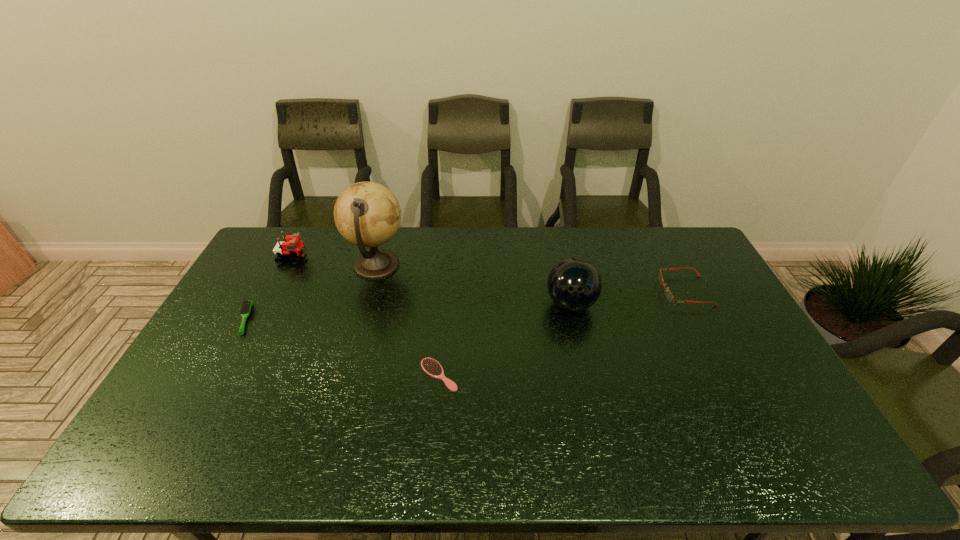
Where is `Lego that is positioned at the far edge`? The height and width of the screenshot is (540, 960). Lego that is positioned at the far edge is located at coordinates (292, 247).

Locate an element on the screen. Lego that is at the left edge is located at coordinates (292, 247).

Find the location of `hairbrush that is positioned at the left edge`. hairbrush that is positioned at the left edge is located at coordinates (245, 309).

What are the coordinates of `object located in the right edge section of the desktop` in the screenshot? It's located at (669, 296).

Find the location of a particular element. Image resolution: width=960 pixels, height=540 pixels. object situated at the far left corner is located at coordinates (292, 247).

In the image, there is a desktop. Identify the location of free space at the far edge. (547, 247).

Locate an element on the screen. This screenshot has width=960, height=540. free space at the near edge of the desktop is located at coordinates (547, 467).

At what (x,y) coordinates should I click in order to perform the action: click on blank area at the left edge. Please return your answer as a coordinate pair (x, y). The width and height of the screenshot is (960, 540). Looking at the image, I should click on (204, 435).

In the image, there is a desktop. Where is `free space at the right edge`? The image size is (960, 540). free space at the right edge is located at coordinates (744, 327).

The height and width of the screenshot is (540, 960). In the image, there is a desktop. Identify the location of vacant space at the far right corner. (676, 229).